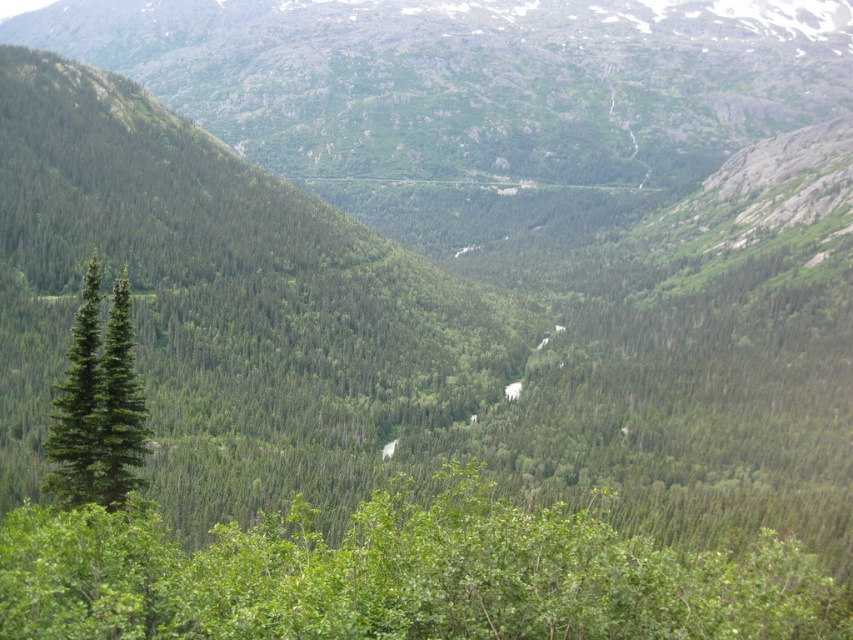
You are planning to plant a new tree in the valley. You have two options based on the image provided. Which tree, the green leafy tree at lower left or the green matte tree at left, would require more horizontal space due to its wider spread?

The green leafy tree at lower left requires more horizontal space because its width is larger than the green matte tree at left.

You are planning to plant a new tree in the valley. The new tree requires a minimum of 60 feet of space between it and any existing trees to ensure healthy growth. Given the distance between the green leafy tree at lower left and the green matte tree at left, can you plant the new tree between them without violating the spacing requirement?

The green leafy tree at lower left and the green matte tree at left are 62.55 feet apart. Since the required minimum spacing is 60 feet, planting the new tree between them would be possible as the existing distance exceeds the required minimum.

You are standing at the center of the valley and want to locate the green leafy tree at lower left. Which direction should you face to see it?

To locate the green leafy tree at lower left, you should face towards the lower left direction from your current position at the center of the valley.